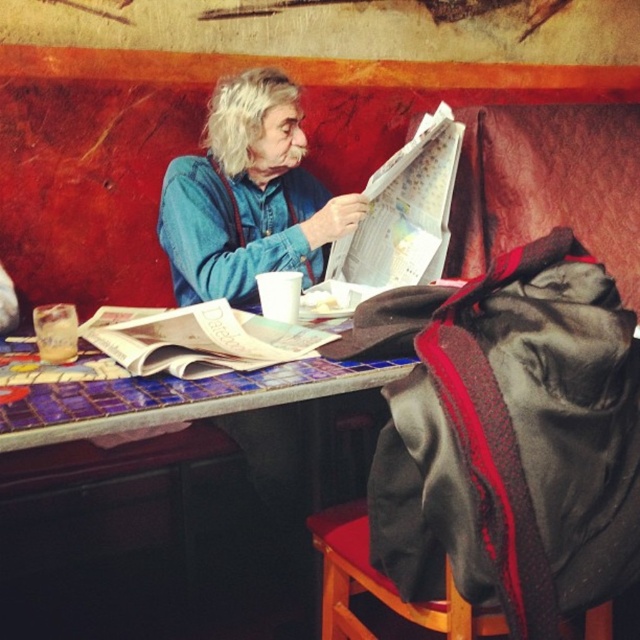
You are a tailor measuring the blue denim shirt at center and the white glossy newspaper at center. Which item has a larger size?

The blue denim shirt at center has a larger size compared to the white glossy newspaper at center.

You are helping to organize a room and need to move the wooden stool at lower right. Since the blue denim shirt at center is on it, can you move the stool without removing the shirt first?

The blue denim shirt at center is positioned over the wooden stool at lower right, so you cannot move the stool without removing the shirt first.